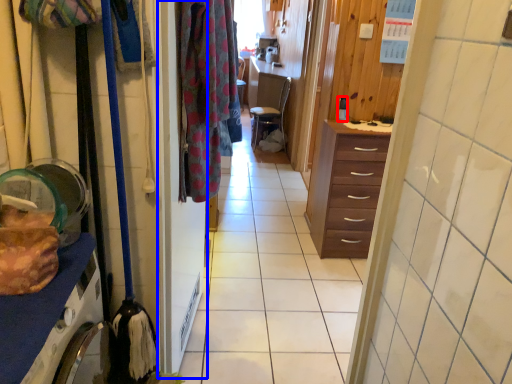
Question: Which object appears farthest to the camera in this image, coffee cup (highlighted by a red box) or screen door (highlighted by a blue box)?

Choices:
 (A) coffee cup
 (B) screen door

Answer: (A)